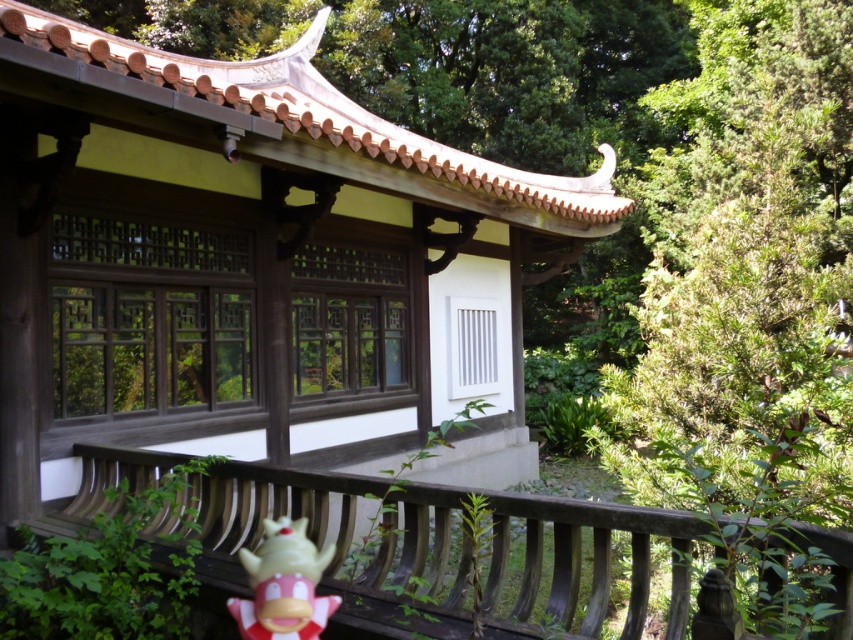
Question: Among these objects, which one is nearest to the camera?

Choices:
 (A) plush yellow toy at lower center
 (B) smooth wooden balustrade at lower center

Answer: (B)

Question: Can you confirm if smooth wooden balustrade at lower center is thinner than plush yellow toy at lower center?

Choices:
 (A) yes
 (B) no

Answer: (B)

Question: Among these points, which one is farthest from the camera?

Choices:
 (A) (273, 596)
 (B) (697, 520)

Answer: (A)

Question: Does smooth wooden balustrade at lower center appear on the right side of plush yellow toy at lower center?

Choices:
 (A) yes
 (B) no

Answer: (A)

Question: Does smooth wooden balustrade at lower center come behind plush yellow toy at lower center?

Choices:
 (A) yes
 (B) no

Answer: (B)